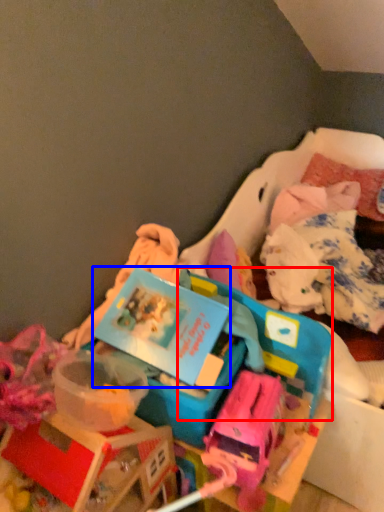
Question: Which object appears closest to the camera in this image, storage box (highlighted by a red box) or kit (highlighted by a blue box)?

Choices:
 (A) storage box
 (B) kit

Answer: (B)